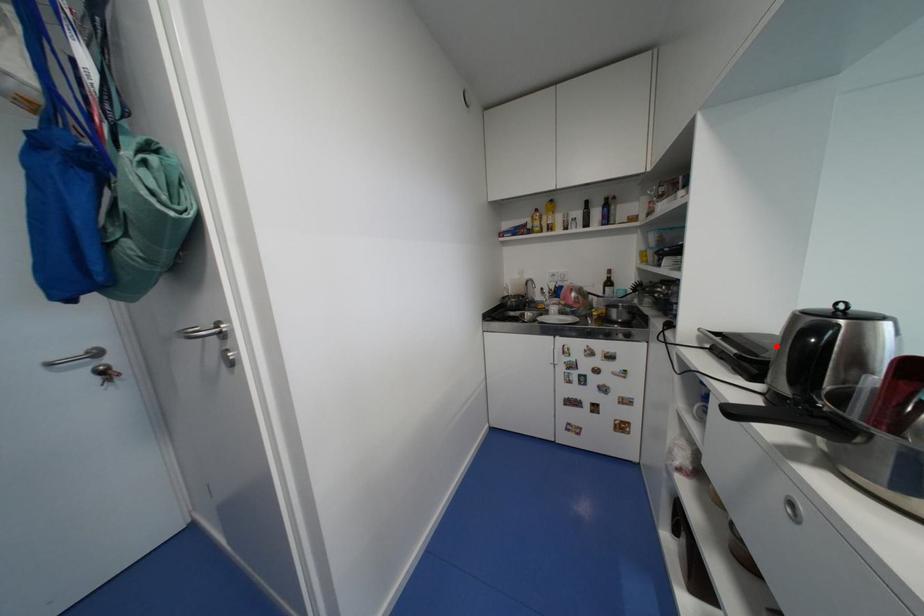
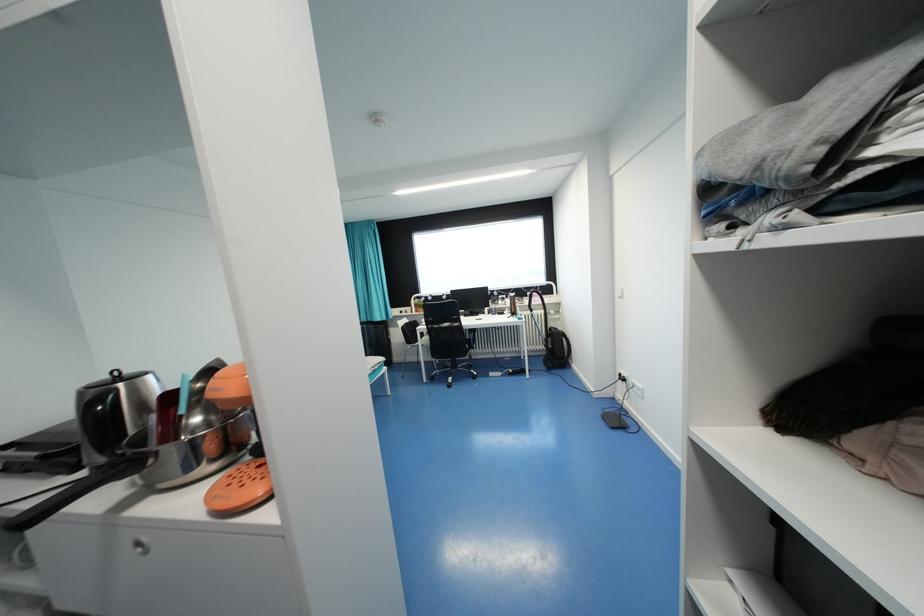
Locate, in the second image, the point that corresponds to the highlighted location in the first image.

(79, 429)